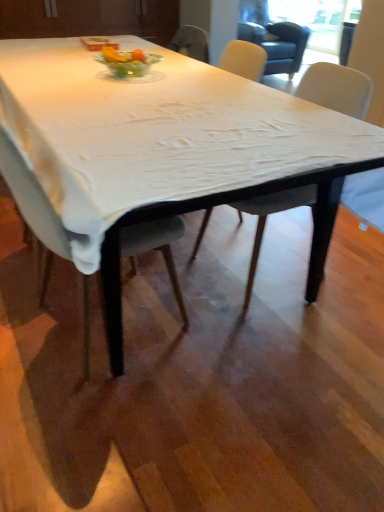
You are a GUI agent. You are given a task and a screenshot of the screen. Output one action in this format:
    pyautogui.click(x=<x>, y=<y>)
    Task: Click on the free area in between white fabric chair at center, which is the first chair from right to left, and matte gray chair at center, which is the 2th chair in right-to-left order
    This screenshot has height=512, width=384.
    Given the screenshot: What is the action you would take?
    pyautogui.click(x=198, y=305)